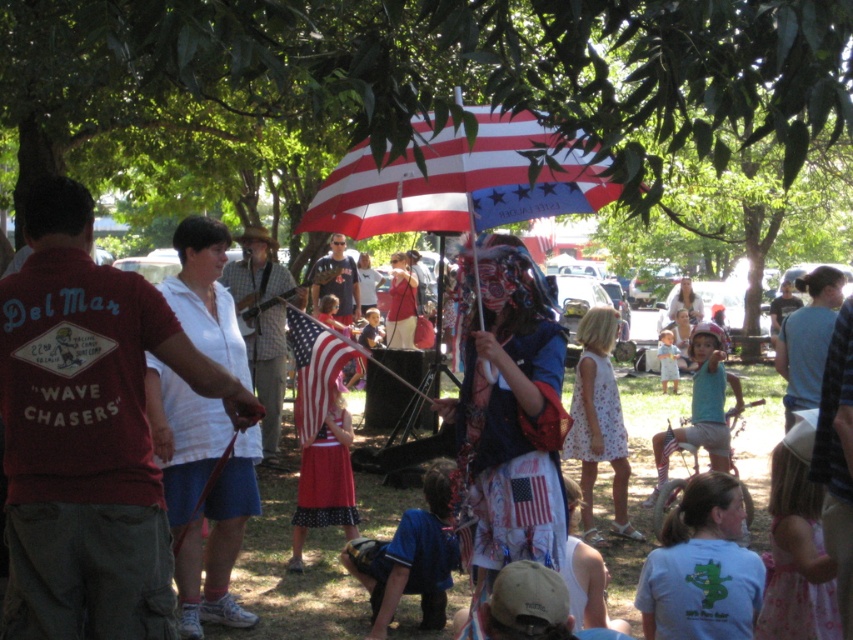
Can you confirm if white cotton t-shirt at lower right is bigger than american flag at center?

Incorrect, white cotton t-shirt at lower right is not larger than american flag at center.

Does white cotton t-shirt at lower right have a greater width compared to american flag at center?

Yes, white cotton t-shirt at lower right is wider than american flag at center.

Who is more distant from viewer, (665, 604) or (312, 410)?

Point (312, 410)

Image resolution: width=853 pixels, height=640 pixels. I want to click on white cotton t-shirt at lower right, so click(701, 566).

Which is in front, point (314, 474) or point (299, 374)?

Point (299, 374) is more forward.

Between point (337, 522) and point (340, 349), which one is positioned in front?

Point (340, 349) is more forward.

Find the location of a particular element. red fabric skirt at center is located at coordinates (325, 480).

Does white cotton t-shirt at lower right have a greater height compared to red fabric skirt at center?

Incorrect, white cotton t-shirt at lower right's height is not larger of red fabric skirt at center's.

Locate an element on the screen. This screenshot has width=853, height=640. white cotton t-shirt at lower right is located at coordinates (701, 566).

At what (x,y) coordinates should I click in order to perform the action: click on white cotton t-shirt at lower right. Please return your answer as a coordinate pair (x, y). This screenshot has width=853, height=640. Looking at the image, I should click on (701, 566).